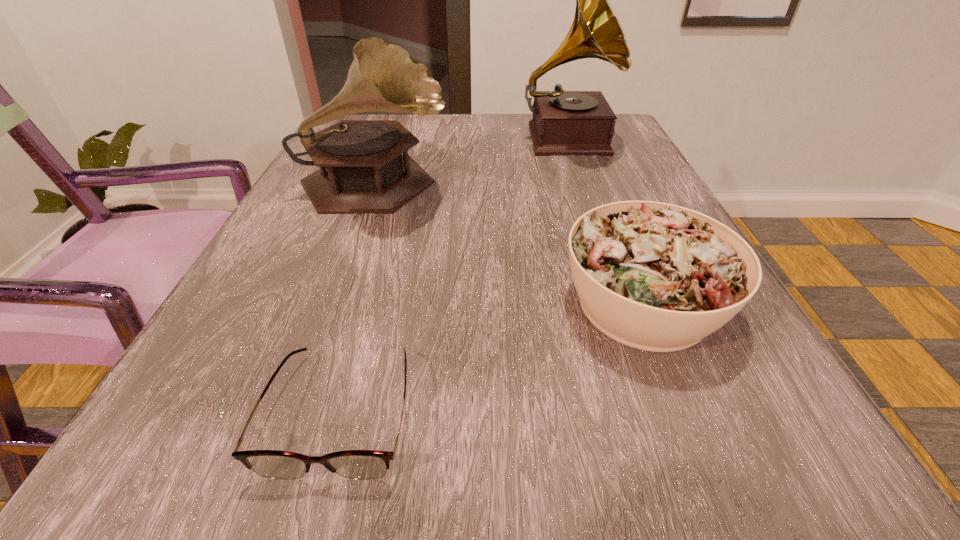
Find the location of a particular element. free space at the right edge of the desktop is located at coordinates (756, 422).

Locate an element on the screen. vacant space at the far left corner of the desktop is located at coordinates (376, 119).

The height and width of the screenshot is (540, 960). In the image, there is a desktop. Identify the location of free space at the near right corner. (747, 487).

Locate an element on the screen. Image resolution: width=960 pixels, height=540 pixels. free space between the third shortest object and the spectacles is located at coordinates (358, 299).

Find the location of a particular element. Image resolution: width=960 pixels, height=540 pixels. free area in between the third tallest object and the left phonograph record is located at coordinates (509, 246).

The image size is (960, 540). Find the location of `blank region between the shortest object and the right phonograph record`. blank region between the shortest object and the right phonograph record is located at coordinates (454, 275).

Find the location of a particular element. Image resolution: width=960 pixels, height=540 pixels. empty location between the spectacles and the taller phonograph record is located at coordinates (454, 275).

You are a GUI agent. You are given a task and a screenshot of the screen. Output one action in this format:
    pyautogui.click(x=<x>, y=<y>)
    Task: Click on the free space between the taller phonograph record and the spectacles
    This screenshot has width=960, height=540.
    Given the screenshot: What is the action you would take?
    pyautogui.click(x=454, y=275)

Find the location of a particular element. The height and width of the screenshot is (540, 960). vacant area between the salad and the shortest object is located at coordinates (492, 357).

What are the coordinates of `vacant area between the taller phonograph record and the left phonograph record` in the screenshot? It's located at (470, 164).